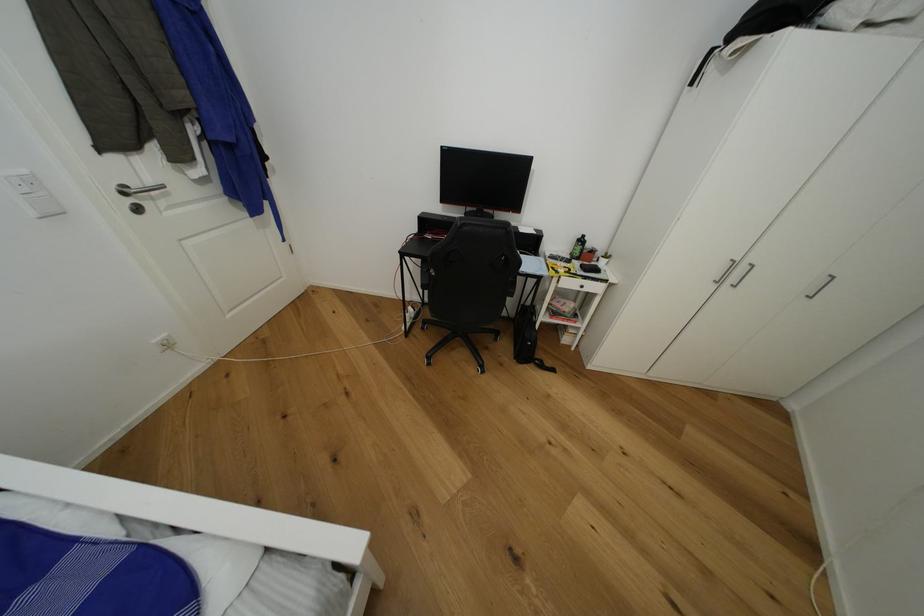
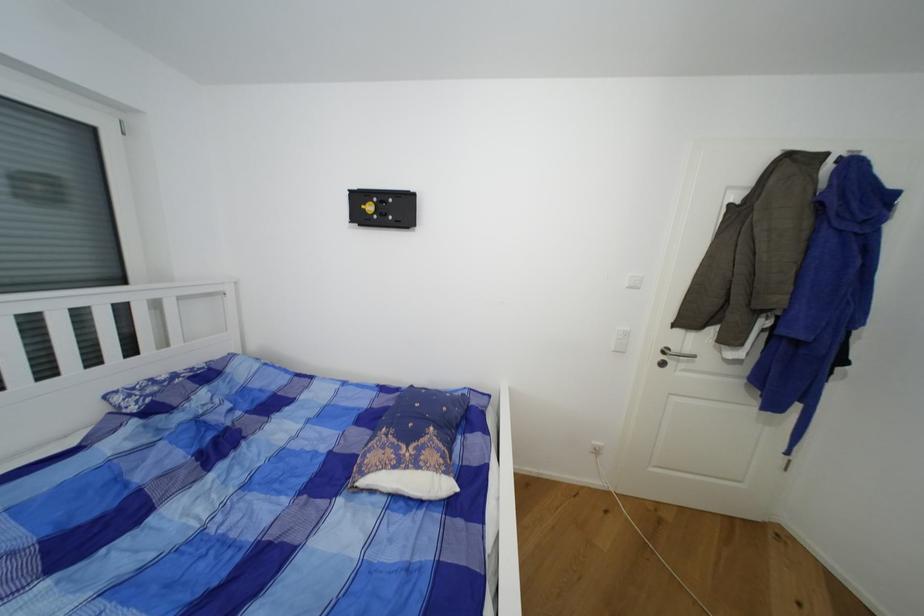
In the second image, find the point that corresponds to point (155, 184) in the first image.

(691, 352)